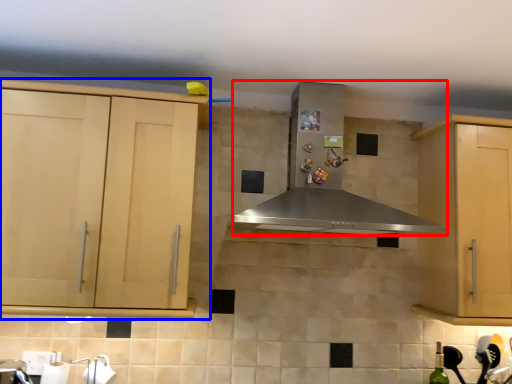
Question: Which object is closer to the camera taking this photo, home appliance (highlighted by a red box) or cabinetry (highlighted by a blue box)?

Choices:
 (A) home appliance
 (B) cabinetry

Answer: (A)